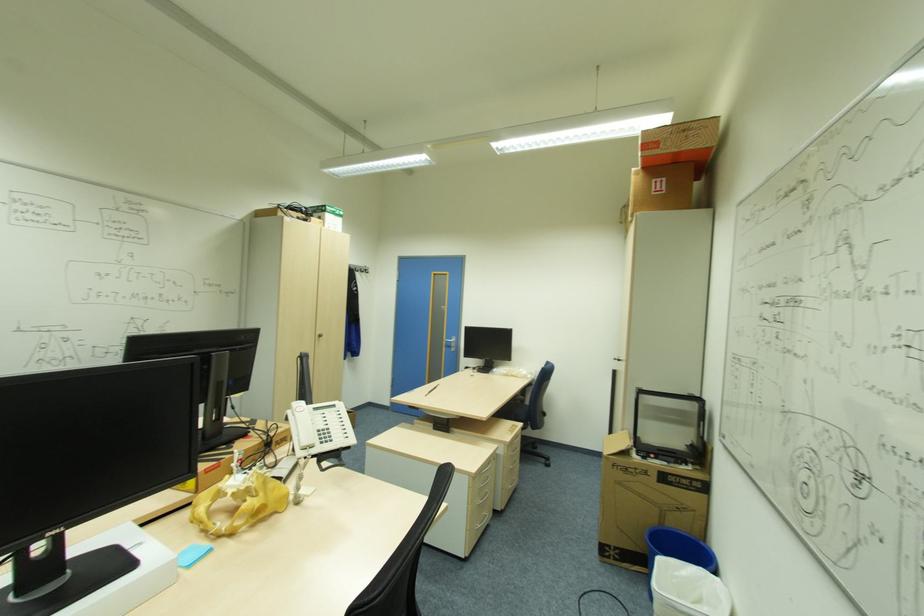
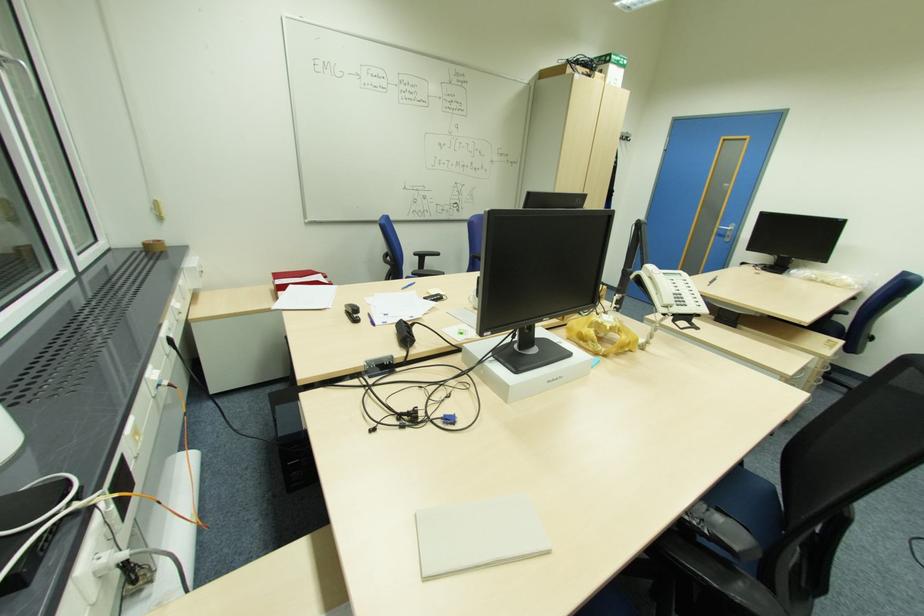
Find the pixel in the second image that matches point 529,405 in the first image.

(839, 322)